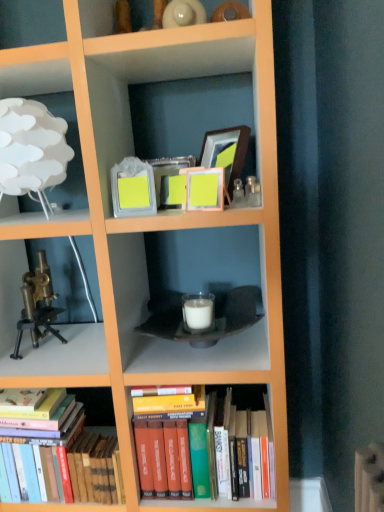
Describe the element at coordinates (35, 77) in the screenshot. I see `white paper lampshade at upper left` at that location.

What is the approximate width of wooden picture frame at upper center, the first picture frame positioned from the right?

It is 3.34 inches.

You are a GUI agent. You are given a task and a screenshot of the screen. Output one action in this format:
    pyautogui.click(x=<x>, y=<y>)
    Task: Click on the matte glass picture frame at upper center, arranged as the 2th picture frame when viewed from the front
    Image resolution: width=384 pixels, height=512 pixels.
    Given the screenshot: What is the action you would take?
    pyautogui.click(x=133, y=188)

Describe the element at coordinates (62, 463) in the screenshot. I see `hardcover books at lower left, acting as the first book starting from the left` at that location.

How much space does hardcover books at lower left, which appears as the second book when viewed from the right, occupy vertically?

The height of hardcover books at lower left, which appears as the second book when viewed from the right, is 13.66 inches.

You are a GUI agent. You are given a task and a screenshot of the screen. Output one action in this format:
    pyautogui.click(x=<x>, y=<y>)
    Task: Click on the white paper lampshade at upper left
    This screenshot has height=512, width=384.
    Given the screenshot: What is the action you would take?
    pyautogui.click(x=35, y=77)

Is point (198, 180) positioned in front of point (51, 449)?

Yes, point (198, 180) is in front of point (51, 449).

Considering their positions, is matte yellow picture frame at center, the 2th picture frame from the right, located in front of or behind hardcover books at lower left, acting as the first book starting from the left?

Visually, matte yellow picture frame at center, the 2th picture frame from the right, is located in front of hardcover books at lower left, acting as the first book starting from the left.

Could hardcover books at lower left, acting as the first book starting from the left, be considered to be inside matte yellow picture frame at center, the 2th picture frame from the right?

That's incorrect, hardcover books at lower left, acting as the first book starting from the left, is not inside matte yellow picture frame at center, the 2th picture frame from the right.

Measure the distance from matte yellow picture frame at center, the second picture frame from the left, to hardcover books at lower left, acting as the first book starting from the left.

matte yellow picture frame at center, the second picture frame from the left, and hardcover books at lower left, acting as the first book starting from the left, are 32.59 inches apart from each other.

From the image's perspective, is matte yellow picture frame at center, arranged as the third picture frame when viewed from the back, located above wooden picture frame at upper center, which appears as the third picture frame when viewed from the front?

No, from the image's perspective, matte yellow picture frame at center, arranged as the third picture frame when viewed from the back, is not over wooden picture frame at upper center, which appears as the third picture frame when viewed from the front.

Is matte yellow picture frame at center, the second picture frame from the left, next to wooden picture frame at upper center, the first picture frame positioned from the right?

No, matte yellow picture frame at center, the second picture frame from the left, is not in contact with wooden picture frame at upper center, the first picture frame positioned from the right.

How different are the orientations of matte yellow picture frame at center, arranged as the third picture frame when viewed from the back, and wooden picture frame at upper center, which appears as the third picture frame when viewed from the front, in degrees?

The facing directions of matte yellow picture frame at center, arranged as the third picture frame when viewed from the back, and wooden picture frame at upper center, which appears as the third picture frame when viewed from the front, are 20.8 degrees apart.

Based on the photo, from a real-world perspective, is wooden picture frame at upper center, the first picture frame positioned from the right, positioned above or below hardcover books at lower left, acting as the first book starting from the left?

Clearly, from a real-world perspective, wooden picture frame at upper center, the first picture frame positioned from the right, is above hardcover books at lower left, acting as the first book starting from the left.

From the image's perspective, which object appears higher, wooden picture frame at upper center, the first picture frame positioned from the right, or hardcover books at lower left, which appears as the second book when viewed from the right?

wooden picture frame at upper center, the first picture frame positioned from the right, is shown above in the image.

Does wooden picture frame at upper center, arranged as the third picture frame when viewed from the left, have a larger size compared to hardcover books at lower left, which appears as the second book when viewed from the right?

No.

Considering the positions of objects wooden picture frame at upper center, which appears as the third picture frame when viewed from the front, and hardcover books at lower left, which appears as the second book when viewed from the right, in the image provided, who is more to the right, wooden picture frame at upper center, which appears as the third picture frame when viewed from the front, or hardcover books at lower left, which appears as the second book when viewed from the right,?

Positioned to the right is wooden picture frame at upper center, which appears as the third picture frame when viewed from the front.

From the image's perspective, which is below, matte glass picture frame at upper center, which ranks as the first picture frame in left-to-right order, or white paper lampshade at upper left?

matte glass picture frame at upper center, which ranks as the first picture frame in left-to-right order, is shown below in the image.

What are the coordinates of `picture frame that is the 1st object located below the white paper lampshade at upper left (from the image's perspective)` in the screenshot? It's located at (133, 188).

Could you tell me if matte glass picture frame at upper center, which ranks as the first picture frame in left-to-right order, is facing white paper lampshade at upper left?

No, matte glass picture frame at upper center, which ranks as the first picture frame in left-to-right order, is not aimed at white paper lampshade at upper left.

Is matte glass picture frame at upper center, the third picture frame when ordered from right to left, located outside white paper lampshade at upper left?

Yes, matte glass picture frame at upper center, the third picture frame when ordered from right to left, is outside of white paper lampshade at upper left.

Does point (222, 406) come behind point (214, 197)?

Yes, point (222, 406) is farther from viewer.

This screenshot has width=384, height=512. Find the location of `the 1st picture frame directly above the hardcover books at center, the first book viewed from the right (from a real-world perspective)`. the 1st picture frame directly above the hardcover books at center, the first book viewed from the right (from a real-world perspective) is located at coordinates (205, 189).

Is hardcover books at center, the first book viewed from the right, aimed at matte yellow picture frame at center, the 2th picture frame from the right?

No, hardcover books at center, the first book viewed from the right, does not turn towards matte yellow picture frame at center, the 2th picture frame from the right.

Do you think brass metallic microscope at left is within matte glass picture frame at upper center, which is the second picture frame from back to front, or outside of it?

brass metallic microscope at left exists outside the volume of matte glass picture frame at upper center, which is the second picture frame from back to front.

Considering the sizes of objects brass metallic microscope at left and matte glass picture frame at upper center, which ranks as the first picture frame in left-to-right order, in the image provided, who is thinner, brass metallic microscope at left or matte glass picture frame at upper center, which ranks as the first picture frame in left-to-right order,?

With smaller width is matte glass picture frame at upper center, which ranks as the first picture frame in left-to-right order.

Which is in front, brass metallic microscope at left or matte glass picture frame at upper center, arranged as the 2th picture frame when viewed from the front?

matte glass picture frame at upper center, arranged as the 2th picture frame when viewed from the front.

Is brass metallic microscope at left looking in the opposite direction of matte glass picture frame at upper center, which is the second picture frame from back to front?

That's not correct — brass metallic microscope at left is not looking away from matte glass picture frame at upper center, which is the second picture frame from back to front.

Between white paper lampshade at upper left and matte yellow picture frame at center, positioned as the 1th picture frame in front-to-back order, which one appears on the left side from the viewer's perspective?

From the viewer's perspective, white paper lampshade at upper left appears more on the left side.

Considering the positions of point (62, 67) and point (213, 203), is point (62, 67) closer or farther from the camera than point (213, 203)?

Point (62, 67) is positioned farther from the camera compared to point (213, 203).

Considering the relative sizes of white paper lampshade at upper left and matte yellow picture frame at center, positioned as the 1th picture frame in front-to-back order, in the image provided, is white paper lampshade at upper left taller than matte yellow picture frame at center, positioned as the 1th picture frame in front-to-back order,?

Yes.

How different are the orientations of white paper lampshade at upper left and matte yellow picture frame at center, positioned as the 1th picture frame in front-to-back order, in degrees?

22.9 degrees separate the facing orientations of white paper lampshade at upper left and matte yellow picture frame at center, positioned as the 1th picture frame in front-to-back order.

Locate an element on the screen. The width and height of the screenshot is (384, 512). the 2nd book behind the matte yellow picture frame at center, arranged as the third picture frame when viewed from the back is located at coordinates (62, 463).

The width and height of the screenshot is (384, 512). Identify the location of the 2nd picture frame in front when counting from the wooden picture frame at upper center, which appears as the 1th picture frame when viewed from the back. (205, 189).

Looking at this image, which object lies further to the anchor point matte glass picture frame at upper center, which ranks as the first picture frame in left-to-right order, white paper lampshade at upper left or hardcover books at lower left, acting as the first book starting from the left?

The object further to matte glass picture frame at upper center, which ranks as the first picture frame in left-to-right order, is hardcover books at lower left, acting as the first book starting from the left.

Estimate the real-world distances between objects in this image. Which object is further from hardcover books at center, the first book viewed from the right, white paper lampshade at upper left or hardcover books at lower left, acting as the first book starting from the left?

white paper lampshade at upper left is positioned further to the anchor hardcover books at center, the first book viewed from the right.

Looking at the image, which one is located closer to wooden picture frame at upper center, which appears as the third picture frame when viewed from the front, brass metallic microscope at left or matte yellow picture frame at center, the 2th picture frame from the right?

matte yellow picture frame at center, the 2th picture frame from the right.

When comparing their distances from matte yellow picture frame at center, arranged as the third picture frame when viewed from the back, does white paper lampshade at upper left or matte glass picture frame at upper center, arranged as the 2th picture frame when viewed from the front, seem closer?

matte glass picture frame at upper center, arranged as the 2th picture frame when viewed from the front.

Considering their positions, is wooden picture frame at upper center, arranged as the third picture frame when viewed from the left, positioned closer to matte glass picture frame at upper center, arranged as the 2th picture frame when viewed from the front, than white paper lampshade at upper left?

Based on the image, wooden picture frame at upper center, arranged as the third picture frame when viewed from the left, appears to be nearer to matte glass picture frame at upper center, arranged as the 2th picture frame when viewed from the front.

From the image, which object appears to be nearer to wooden picture frame at upper center, the first picture frame positioned from the right, hardcover books at center, the first book viewed from the right, or matte yellow picture frame at center, positioned as the 1th picture frame in front-to-back order?

matte yellow picture frame at center, positioned as the 1th picture frame in front-to-back order.

From the image, which object appears to be nearer to hardcover books at lower left, which appears as the second book when viewed from the right, wooden picture frame at upper center, arranged as the third picture frame when viewed from the left, or brass metallic microscope at left?

brass metallic microscope at left.

Considering their positions, is matte glass picture frame at upper center, which ranks as the first picture frame in left-to-right order, positioned further to brass metallic microscope at left than matte yellow picture frame at center, arranged as the third picture frame when viewed from the back?

Based on the image, matte yellow picture frame at center, arranged as the third picture frame when viewed from the back, appears to be further to brass metallic microscope at left.

Find the location of `picture frame between matte glass picture frame at upper center, arranged as the 2th picture frame when viewed from the front, and hardcover books at center, the first book viewed from the right, vertically`. picture frame between matte glass picture frame at upper center, arranged as the 2th picture frame when viewed from the front, and hardcover books at center, the first book viewed from the right, vertically is located at coordinates (205, 189).

Where is `shelf situated between brass metallic microscope at left and matte yellow picture frame at center, positioned as the 1th picture frame in front-to-back order, from left to right`? shelf situated between brass metallic microscope at left and matte yellow picture frame at center, positioned as the 1th picture frame in front-to-back order, from left to right is located at coordinates (35, 77).

The width and height of the screenshot is (384, 512). I want to click on toy between white paper lampshade at upper left and hardcover books at lower left, acting as the first book starting from the left, in the vertical direction, so click(x=37, y=305).

Identify the location of picture frame between brass metallic microscope at left and matte yellow picture frame at center, positioned as the 1th picture frame in front-to-back order, in the horizontal direction. The image size is (384, 512). (133, 188).